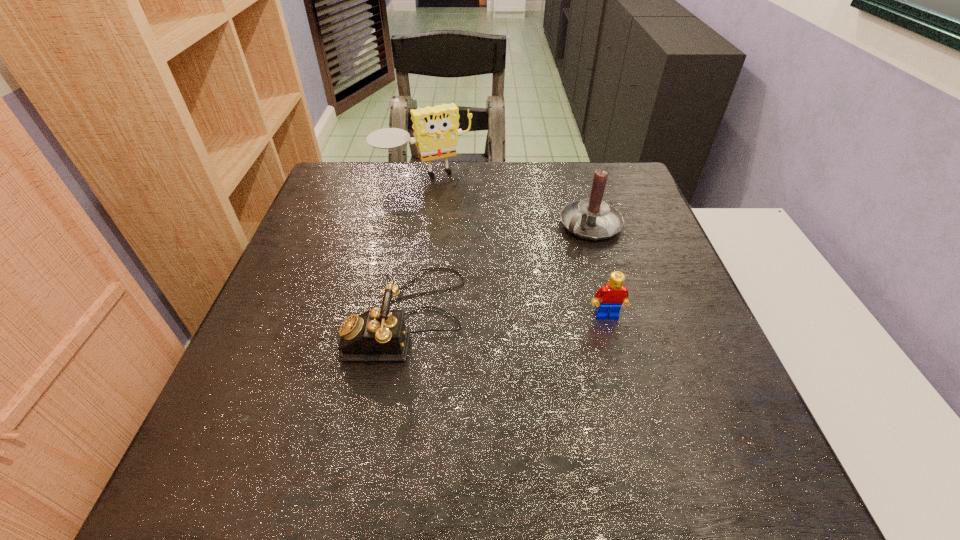
Find the location of `candle at the right edge`. candle at the right edge is located at coordinates (594, 219).

At what (x,y) coordinates should I click in order to perform the action: click on object located at the far left corner. Please return your answer as a coordinate pair (x, y). The width and height of the screenshot is (960, 540). Looking at the image, I should click on (436, 132).

Identify the location of object that is at the far right corner. (594, 219).

Where is `blank space at the far edge of the desktop`? The width and height of the screenshot is (960, 540). blank space at the far edge of the desktop is located at coordinates (491, 197).

This screenshot has width=960, height=540. Identify the location of vacant space at the left edge of the desktop. coord(317,290).

The image size is (960, 540). In order to click on free space at the right edge of the desktop in this screenshot , I will do `click(650, 297)`.

In the image, there is a desktop. Find the location of `vacant space at the far left corner`. vacant space at the far left corner is located at coordinates click(381, 163).

This screenshot has height=540, width=960. Identify the location of vacant space at the far right corner of the desktop. (606, 168).

This screenshot has width=960, height=540. What are the coordinates of `free spot between the telephone and the Lego` in the screenshot? It's located at (507, 316).

Find the location of a particular element. This screenshot has height=540, width=960. vacant space that's between the telephone and the Lego is located at coordinates (507, 316).